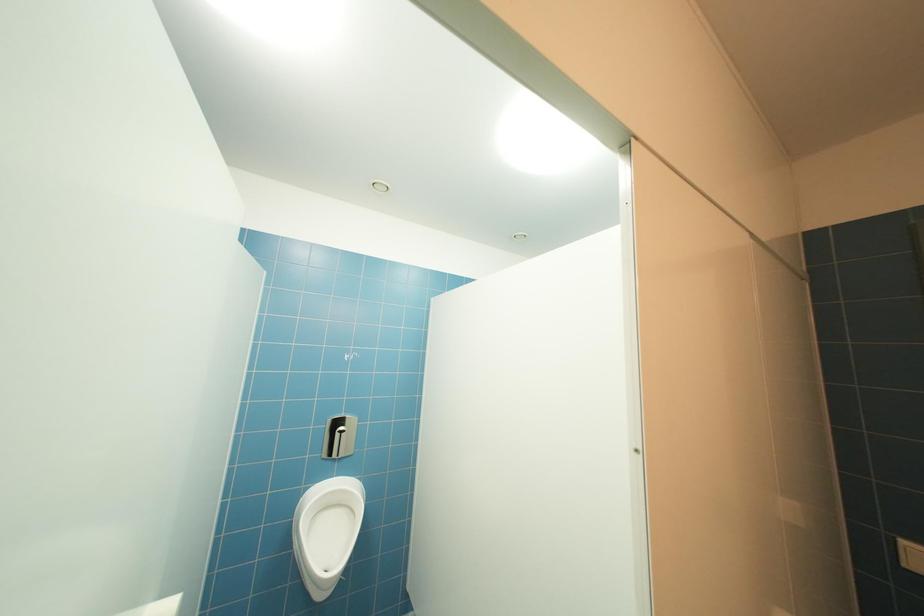
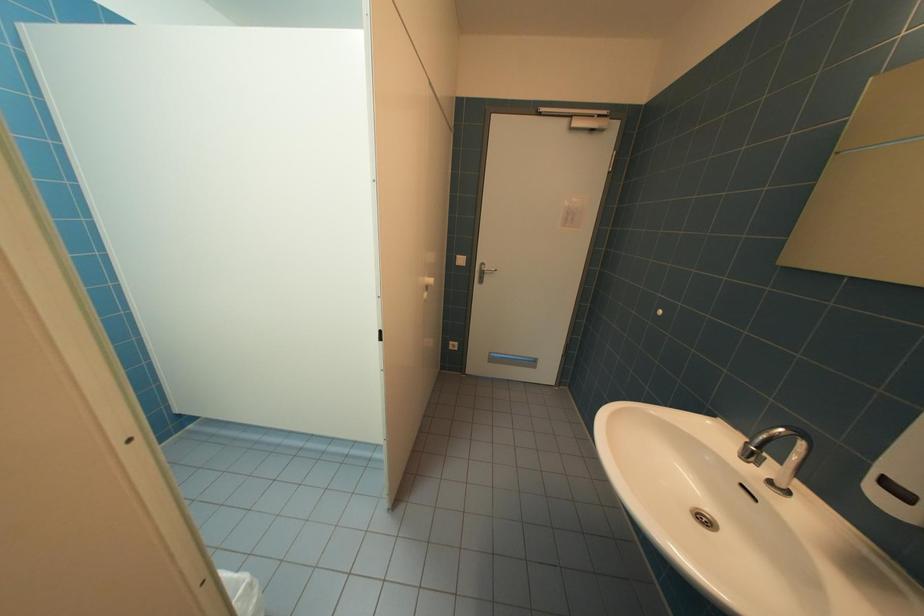
The images are taken continuously from a first-person perspective. In which direction is your viewpoint rotating?

The rotation direction of the camera is right-down.